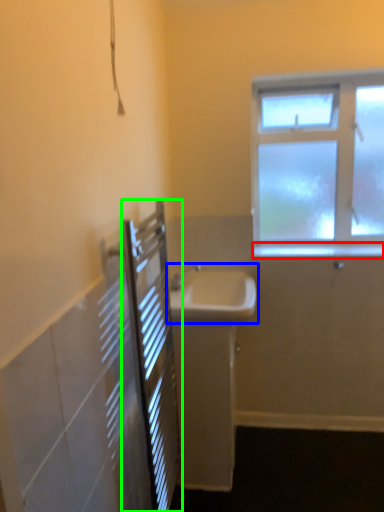
Question: Estimate the real-world distances between objects in this image. Which object is farther from window sill (highlighted by a red box), sink (highlighted by a blue box) or screen door (highlighted by a green box)?

Choices:
 (A) sink
 (B) screen door

Answer: (B)